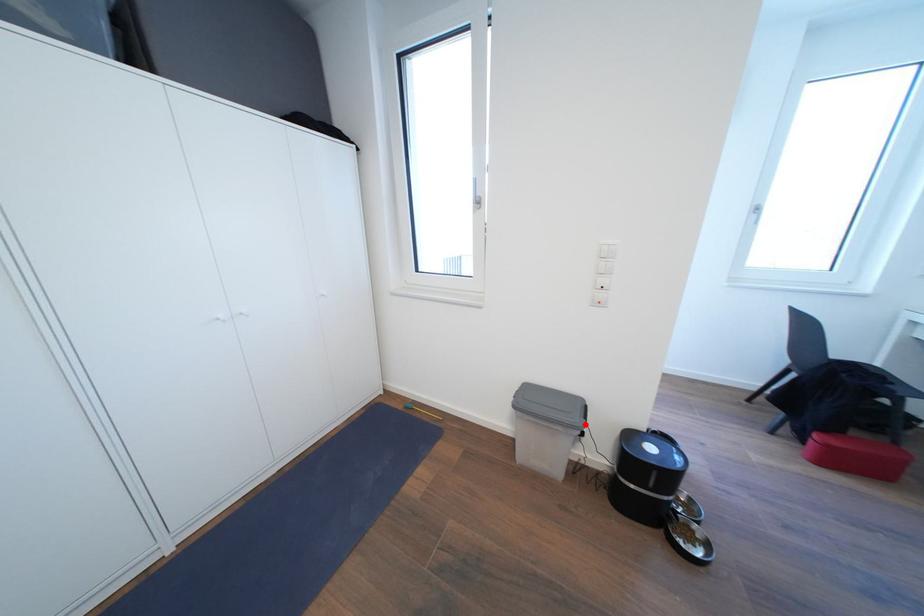
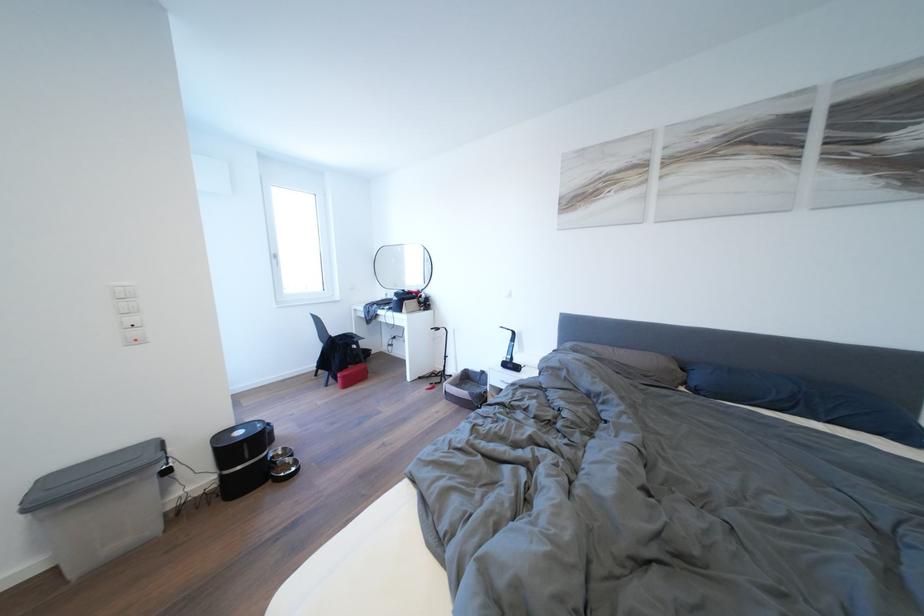
Locate, in the second image, the point that corresponds to the highlighted location in the first image.

(160, 461)